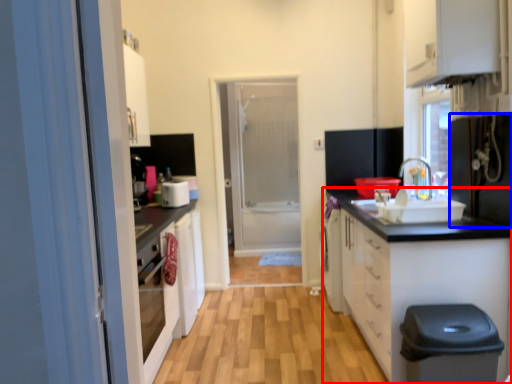
Question: Which object appears closest to the camera in this image, cabinetry (highlighted by a red box) or appliance (highlighted by a blue box)?

Choices:
 (A) cabinetry
 (B) appliance

Answer: (B)